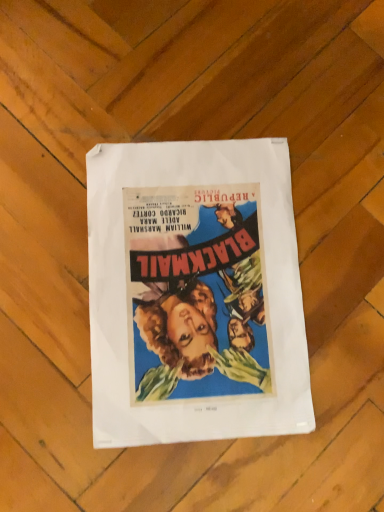
Where is `matte paper poster at center`? The width and height of the screenshot is (384, 512). matte paper poster at center is located at coordinates (195, 293).

What do you see at coordinates (195, 293) in the screenshot? The width and height of the screenshot is (384, 512). I see `matte paper poster at center` at bounding box center [195, 293].

This screenshot has height=512, width=384. I want to click on matte paper poster at center, so click(x=195, y=293).